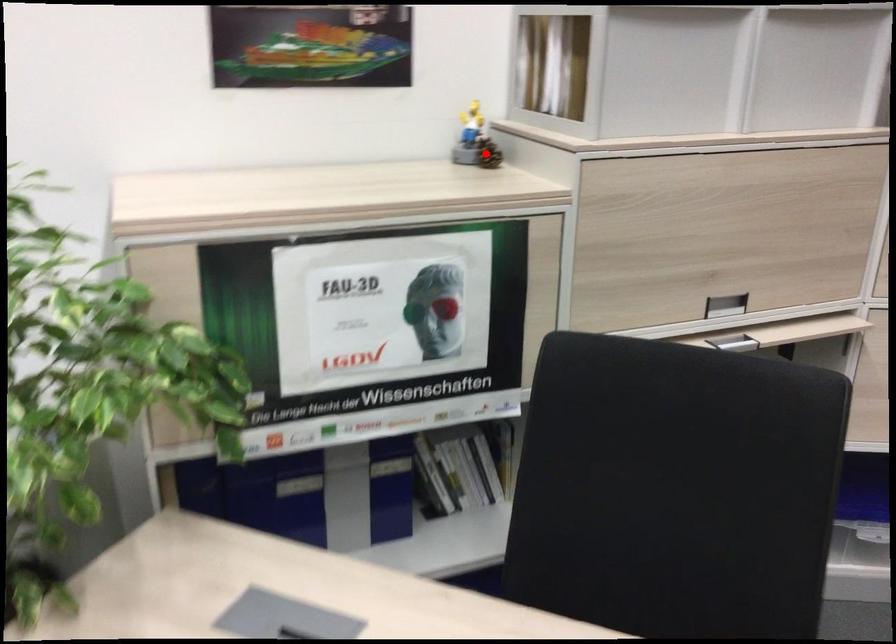
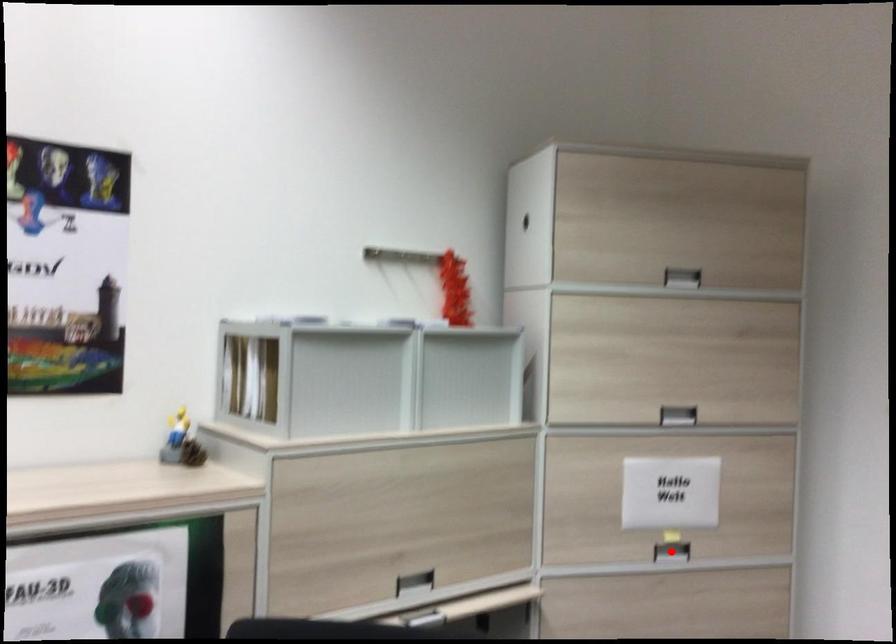
I am providing you with two images of the same scene from different viewpoints. A red point is marked on the first image and another point is marked on the second image. Do the highlighted points in image1 and image2 indicate the same real-world spot?

No